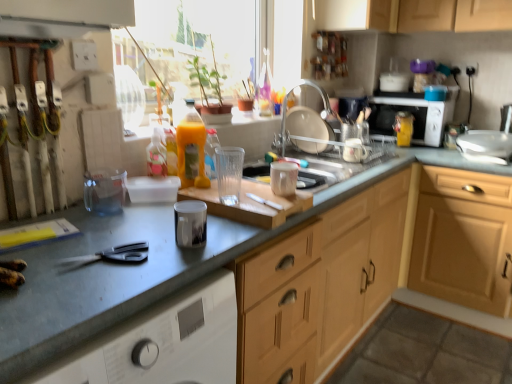
Measure the distance between point (281, 207) and camera.

Point (281, 207) is 3.96 feet from camera.

Identify the location of metallic gray countertop at center-left, which appears as the 1th countertop when viewed from the left. (101, 281).

Describe the element at coordinates (412, 114) in the screenshot. The width and height of the screenshot is (512, 384). I see `white glossy microwave at upper right` at that location.

What do you see at coordinates (211, 153) in the screenshot? I see `translucent plastic bottle at center, acting as the second bottle starting from the front` at bounding box center [211, 153].

Identify the location of translucent plastic bottle at center, which appears as the 2th bottle when viewed from the back. The width and height of the screenshot is (512, 384). (211, 153).

Locate an element on the screen. light wood cabinet at lower right, which is counted as the first cabinetry, starting from the bottom is located at coordinates (463, 239).

From the picture: Is white ceramic mug at upper center, which is counted as the 5th appliance, starting from the bottom, in front of or behind white plastic knife at center in the image?

white ceramic mug at upper center, which is counted as the 5th appliance, starting from the bottom, is behind white plastic knife at center.

What's the angular difference between white ceramic mug at upper center, which is the second appliance in back-to-front order, and white plastic knife at center's facing directions?

white ceramic mug at upper center, which is the second appliance in back-to-front order, and white plastic knife at center are facing 161 degrees away from each other.

Which of these two, white ceramic mug at upper center, arranged as the 2th appliance when viewed from the top, or white plastic knife at center, stands shorter?

With less height is white plastic knife at center.

From the image's perspective, does white plastic microwave at upper right, the sixth appliance in the front-to-back sequence, appear lower than white ceramic mug at upper center, marked as the fifth appliance in a front-to-back arrangement?

No, from the image's perspective, white plastic microwave at upper right, the sixth appliance in the front-to-back sequence, is not below white ceramic mug at upper center, marked as the fifth appliance in a front-to-back arrangement.

From a real-world perspective, is white plastic microwave at upper right, which ranks as the 2th appliance in right-to-left order, on white ceramic mug at upper center, marked as the fifth appliance in a front-to-back arrangement?

Yes, from a real-world perspective, white plastic microwave at upper right, which ranks as the 2th appliance in right-to-left order, is on top of white ceramic mug at upper center, marked as the fifth appliance in a front-to-back arrangement.

Which object is further away from the camera taking this photo, white plastic microwave at upper right, the sixth appliance in the front-to-back sequence, or white ceramic mug at upper center, which ranks as the 4th appliance in left-to-right order?

white plastic microwave at upper right, the sixth appliance in the front-to-back sequence, is further away from the camera.

Where is `appliance that is behind the white ceramic mug at upper center, which is counted as the 5th appliance, starting from the bottom`? This screenshot has width=512, height=384. appliance that is behind the white ceramic mug at upper center, which is counted as the 5th appliance, starting from the bottom is located at coordinates (395, 77).

From a real-world perspective, relative to translucent plastic bottle at center, positioned as the 1th bottle in left-to-right order, is white ceramic mug at upper center, which is the second appliance in back-to-front order, vertically above or below?

white ceramic mug at upper center, which is the second appliance in back-to-front order, is situated lower than translucent plastic bottle at center, positioned as the 1th bottle in left-to-right order, in the real world.

Which object is positioned more to the left, white ceramic mug at upper center, which is the second appliance in back-to-front order, or translucent plastic bottle at center, positioned as the 1th bottle in left-to-right order?

translucent plastic bottle at center, positioned as the 1th bottle in left-to-right order, is more to the left.

Which is in front, white ceramic mug at upper center, which ranks as the 4th appliance in left-to-right order, or translucent plastic bottle at center, positioned as the 1th bottle in left-to-right order?

translucent plastic bottle at center, positioned as the 1th bottle in left-to-right order.

Is white ceramic mug at upper center, which is counted as the 5th appliance, starting from the bottom, oriented towards translucent plastic bottle at center, placed as the 3th bottle when sorted from back to front?

No, white ceramic mug at upper center, which is counted as the 5th appliance, starting from the bottom, is not facing towards translucent plastic bottle at center, placed as the 3th bottle when sorted from back to front.

Is wooden cabinet at upper center, the 1th cabinetry positioned from the left, looking in the opposite direction of white ceramic mug at upper center, which is the second appliance in back-to-front order?

No, wooden cabinet at upper center, the 1th cabinetry positioned from the left, is not facing the opposite direction of white ceramic mug at upper center, which is the second appliance in back-to-front order.

What's the angular difference between wooden cabinet at upper center, which ranks as the second cabinetry in right-to-left order, and white ceramic mug at upper center, marked as the fifth appliance in a front-to-back arrangement,'s facing directions?

The angular difference between wooden cabinet at upper center, which ranks as the second cabinetry in right-to-left order, and white ceramic mug at upper center, marked as the fifth appliance in a front-to-back arrangement, is 1.82 degrees.

From the image's perspective, is wooden cabinet at upper center, the 1th cabinetry positioned from the left, under white ceramic mug at upper center, marked as the fifth appliance in a front-to-back arrangement?

No, from the image's perspective, wooden cabinet at upper center, the 1th cabinetry positioned from the left, is not below white ceramic mug at upper center, marked as the fifth appliance in a front-to-back arrangement.

Is light wood cabinet at lower right, which is counted as the first cabinetry, starting from the bottom, far from translucent plastic bottle at center, the second bottle from the left?

Yes.

Can you confirm if light wood cabinet at lower right, which is counted as the first cabinetry, starting from the bottom, is shorter than translucent plastic bottle at center, the second bottle from the right?

In fact, light wood cabinet at lower right, which is counted as the first cabinetry, starting from the bottom, may be taller than translucent plastic bottle at center, the second bottle from the right.

Looking at this image, is light wood cabinet at lower right, marked as the second cabinetry in a left-to-right arrangement, looking in the opposite direction of translucent plastic bottle at center, acting as the second bottle starting from the front?

light wood cabinet at lower right, marked as the second cabinetry in a left-to-right arrangement, is not turned away from translucent plastic bottle at center, acting as the second bottle starting from the front.

Can you confirm if light wood cabinet at lower right, marked as the second cabinetry in a left-to-right arrangement, is smaller than translucent plastic bottle at center, acting as the second bottle starting from the front?

Actually, light wood cabinet at lower right, marked as the second cabinetry in a left-to-right arrangement, might be larger than translucent plastic bottle at center, acting as the second bottle starting from the front.

Based on the photo, is matte silver tap at upper center beside transparent glass window at upper center?

matte silver tap at upper center and transparent glass window at upper center are not in contact.

In the scene shown: Is matte silver tap at upper center smaller than transparent glass window at upper center?

Correct, matte silver tap at upper center occupies less space than transparent glass window at upper center.

In the scene shown: Considering the sizes of objects matte silver tap at upper center and transparent glass window at upper center in the image provided, who is wider, matte silver tap at upper center or transparent glass window at upper center?

With larger width is matte silver tap at upper center.

Find the location of a particular element. Image resolution: width=512 pixels, height=384 pixels. window positioned vertically above the matte silver tap at upper center (from a real-world perspective) is located at coordinates (199, 40).

Based on the photo, considering the relative sizes of black plastic scissors at lower left and light wood cabinet at lower right, the second cabinetry from the top, in the image provided, is black plastic scissors at lower left taller than light wood cabinet at lower right, the second cabinetry from the top,?

No.

Is light wood cabinet at lower right, the second cabinetry from the top, at the back of black plastic scissors at lower left?

black plastic scissors at lower left does not have its back to light wood cabinet at lower right, the second cabinetry from the top.

From a real-world perspective, which object rests below the other?

light wood cabinet at lower right, which is counted as the first cabinetry, starting from the bottom.

Between black plastic scissors at lower left and light wood cabinet at lower right, marked as the second cabinetry in a left-to-right arrangement, which one is positioned behind?

light wood cabinet at lower right, marked as the second cabinetry in a left-to-right arrangement, is further away from the camera.

The width and height of the screenshot is (512, 384). I want to click on the 3rd appliance above the white plastic knife at center (from a real-world perspective), so click(x=353, y=143).

Find the location of a particular element. the 1st appliance positioned below the white plastic microwave at upper right, the sixth appliance in the front-to-back sequence (from the image's perspective) is located at coordinates (353, 143).

Considering their positions, is wooden cutting board at center positioned further to yellow matte bottle at upper right, arranged as the 3th bottle when viewed from the front, than metallic silver sink at upper right, the 6th appliance in the left-to-right sequence?

Based on the image, wooden cutting board at center appears to be further to yellow matte bottle at upper right, arranged as the 3th bottle when viewed from the front.

From the image, which object appears to be nearer to wooden cabinet at upper center, which ranks as the second cabinetry in right-to-left order, metallic gray cutting board at center, which is the 1th countertop in right-to-left order, or black plastic scissors at lower left?

metallic gray cutting board at center, which is the 1th countertop in right-to-left order, lies closer to wooden cabinet at upper center, which ranks as the second cabinetry in right-to-left order, than the other object.

From the image, which object appears to be farther from shiny metallic cup at center, the 1th appliance from the left, white plastic knife at center or wooden cabinet at upper center, the 2th cabinetry ordered from the bottom?

wooden cabinet at upper center, the 2th cabinetry ordered from the bottom, lies further to shiny metallic cup at center, the 1th appliance from the left, than the other object.

When comparing their distances from yellow matte bottle at upper right, arranged as the 3th bottle when viewed from the front, does wooden cabinet at upper center, the 1th cabinetry positioned from the left, or metallic gray cutting board at center, which is the 1th countertop in right-to-left order, seem further?

metallic gray cutting board at center, which is the 1th countertop in right-to-left order, is further to yellow matte bottle at upper right, arranged as the 3th bottle when viewed from the front.

From the image, which object appears to be nearer to metallic silver sink at upper right, which is the first appliance in right-to-left order, metallic gray countertop at center-left, which ranks as the 2th countertop in right-to-left order, or translucent plastic bottle at center, acting as the 3th bottle starting from the right?

Among the two, translucent plastic bottle at center, acting as the 3th bottle starting from the right, is located nearer to metallic silver sink at upper right, which is the first appliance in right-to-left order.

Looking at the image, which one is located closer to white plastic microwave at upper right, the 5th appliance positioned from the left, transparent glass window at upper center or white glossy microwave at upper right?

white glossy microwave at upper right is positioned closer to the anchor white plastic microwave at upper right, the 5th appliance positioned from the left.

Estimate the real-world distances between objects in this image. Which object is closer to shiny metallic cup at center, which ranks as the first appliance in bottom-to-top order, wooden cabinet at upper center, the 1th cabinetry positioned from the left, or metallic silver sink at upper right, the 4th appliance positioned from the bottom?

metallic silver sink at upper right, the 4th appliance positioned from the bottom, is closer to shiny metallic cup at center, which ranks as the first appliance in bottom-to-top order.

Which object lies further to the anchor point wooden cutting board at center, shiny metallic cup at center, the first appliance in the front-to-back sequence, or translucent plastic bottle at center, acting as the second bottle starting from the front?

Among the two, translucent plastic bottle at center, acting as the second bottle starting from the front, is located further to wooden cutting board at center.

Image resolution: width=512 pixels, height=384 pixels. I want to click on knife located between shiny metallic cup at center, the first appliance in the front-to-back sequence, and metallic gray cutting board at center, which is the 1th countertop in right-to-left order, in the left-right direction, so click(265, 202).

This screenshot has width=512, height=384. What are the coordinates of `appliance between transparent plastic cup at center, which appears as the 5th appliance when viewed from the back, and translucent plastic bottle at center, which appears as the 2th bottle when viewed from the back, from front to back` in the screenshot? It's located at (283, 178).

Identify the location of cutlery located between metallic gray countertop at center-left, which ranks as the 2th countertop in right-to-left order, and white ceramic mug at upper center, which ranks as the 4th appliance in left-to-right order, in the depth direction. This screenshot has height=384, width=512. (115, 254).

Find the location of a particular element. kitchen appliance between shiny metallic cup at center, which ranks as the first appliance in bottom-to-top order, and white plastic microwave at upper right, the sixth appliance in the front-to-back sequence, from front to back is located at coordinates (412, 114).